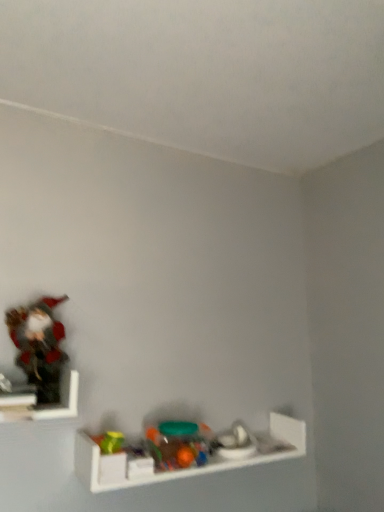
In order to click on blank space above wooden figurine at left, which is counted as the first shelf, starting from the left (from a real-world perspective) in this screenshot , I will do `click(34, 369)`.